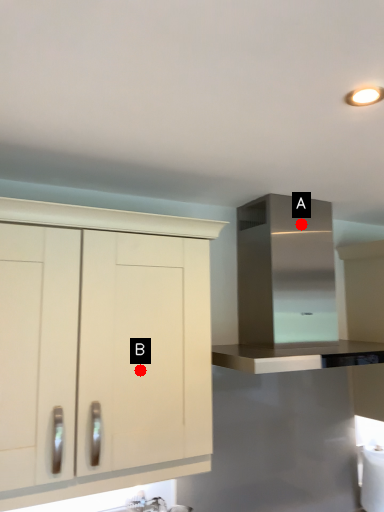
Question: Two points are circled on the image, labeled by A and B beside each circle. Which point is closer to the camera?

Choices:
 (A) A is closer
 (B) B is closer

Answer: (B)